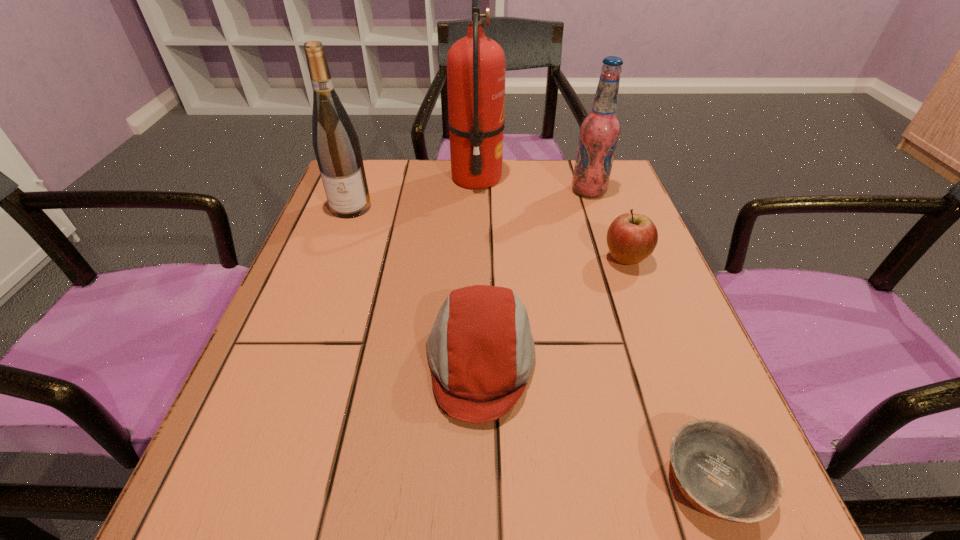
Find the location of a particular element. The width and height of the screenshot is (960, 540). blank region between the second nearest object and the shortest object is located at coordinates (596, 422).

Identify the location of vacant space that's between the fifth farthest object and the third nearest object. The image size is (960, 540). (553, 310).

Find the location of `empty space between the nearest object and the fourth farthest object`. empty space between the nearest object and the fourth farthest object is located at coordinates (669, 370).

The height and width of the screenshot is (540, 960). Find the location of `free space between the leftmost object and the second nearest object`. free space between the leftmost object and the second nearest object is located at coordinates (416, 284).

Locate an element on the screen. This screenshot has height=540, width=960. free space between the alcohol and the bowl is located at coordinates (651, 336).

The image size is (960, 540). I want to click on vacant region between the cap and the fire extinguisher, so click(478, 270).

Locate an element on the screen. The image size is (960, 540). free space that is in between the fifth farthest object and the leftmost object is located at coordinates (416, 284).

The width and height of the screenshot is (960, 540). I want to click on empty location between the alcohol and the apple, so click(607, 225).

You are a GUI agent. You are given a task and a screenshot of the screen. Output one action in this format:
    pyautogui.click(x=<x>, y=<y>)
    Task: Click on the free space between the third tallest object and the fire extinguisher
    This screenshot has width=960, height=540.
    Given the screenshot: What is the action you would take?
    pyautogui.click(x=533, y=184)

Where is `free space between the alcohol and the fire extinguisher`? This screenshot has height=540, width=960. free space between the alcohol and the fire extinguisher is located at coordinates (533, 184).